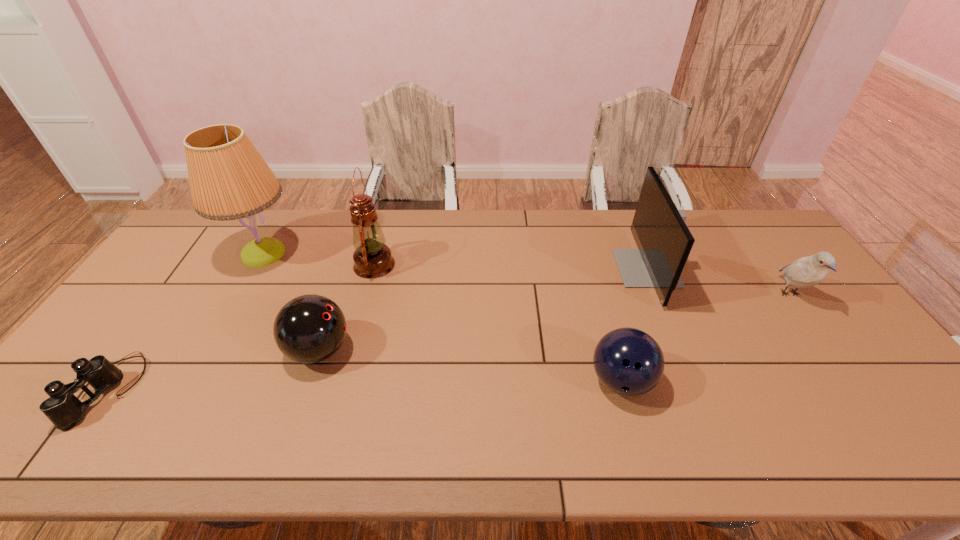
The height and width of the screenshot is (540, 960). Find the location of `free space located 0.200m on the side of the tallest object near the pull switch`. free space located 0.200m on the side of the tallest object near the pull switch is located at coordinates (361, 254).

Where is `vacant space situated on the back of the oil lamp`? The height and width of the screenshot is (540, 960). vacant space situated on the back of the oil lamp is located at coordinates (386, 222).

Find the location of a particular element. The image size is (960, 540). vacant space situated 0.230m on the screen of the fifth shortest object is located at coordinates (546, 268).

Find the location of a particular element. free spot located on the screen of the fifth shortest object is located at coordinates (577, 268).

Locate an element on the screen. This screenshot has width=960, height=540. vacant space located 0.200m on the screen of the fifth shortest object is located at coordinates (556, 268).

I want to click on free space located at the beak of the bird, so click(x=836, y=358).

Identify the location of vacant space located 0.200m on the surface of the left bowling ball near the finger holes. Image resolution: width=960 pixels, height=540 pixels. (427, 350).

You are a GUI agent. You are given a task and a screenshot of the screen. Output one action in this format:
    pyautogui.click(x=<x>, y=<y>)
    Task: Click on the free space located on the back of the binoculars
    This screenshot has height=540, width=960.
    Given the screenshot: What is the action you would take?
    pyautogui.click(x=191, y=274)

Locate an element on the screen. This screenshot has width=960, height=540. lamp located in the far edge section of the desktop is located at coordinates (229, 180).

Locate an element on the screen. oil lamp that is at the far edge is located at coordinates (372, 258).